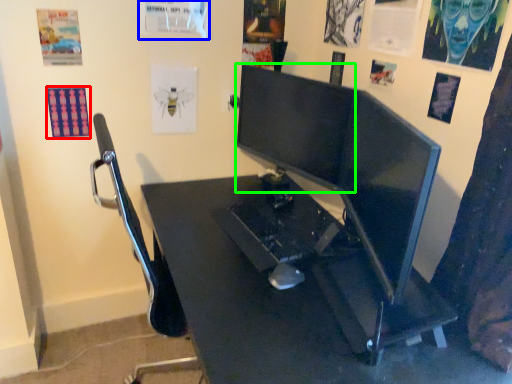
Question: Considering the real-world distances, which object is closest to poster page (highlighted by a red box)? poster page (highlighted by a blue box) or computer monitor (highlighted by a green box).

Choices:
 (A) poster page
 (B) computer monitor

Answer: (A)